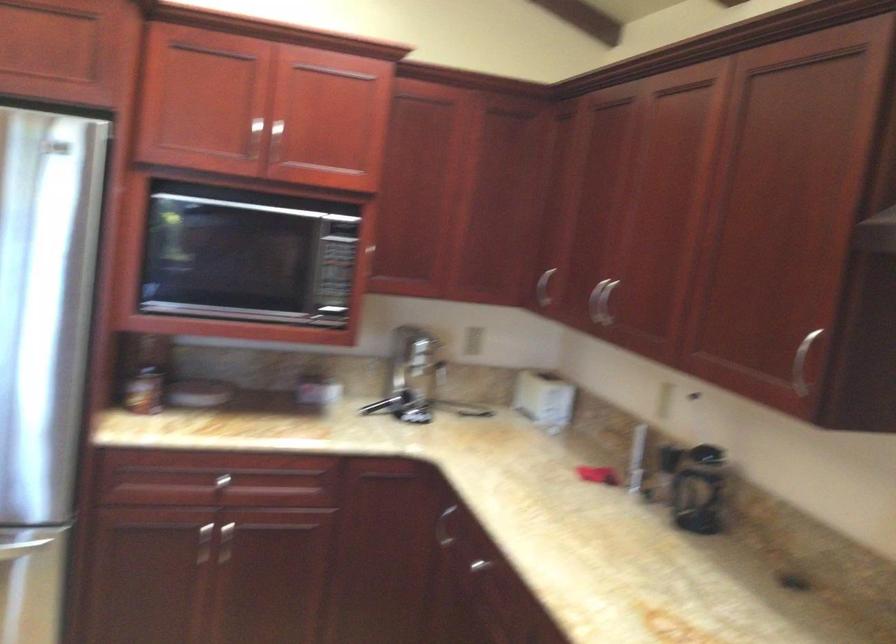
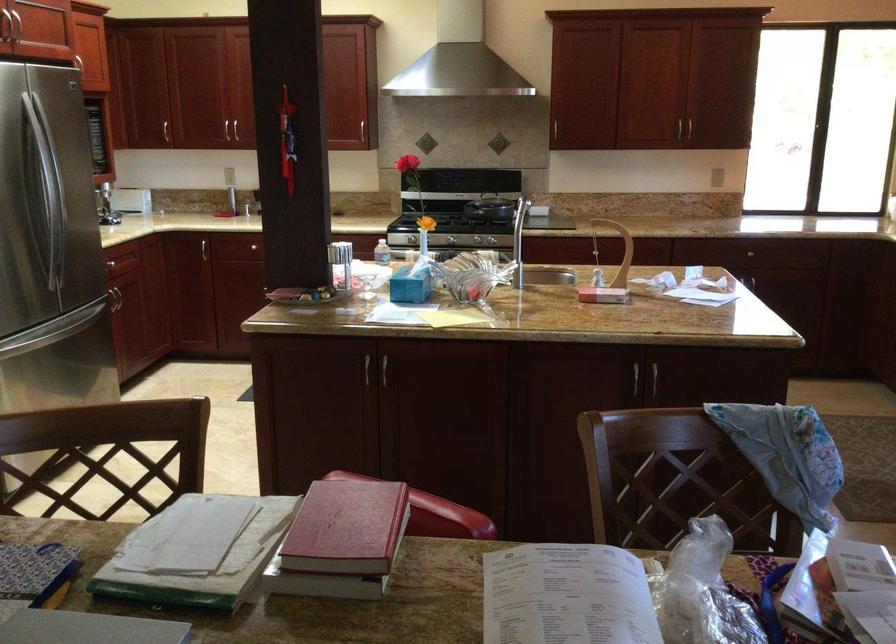
Find the pixel in the second image that matches the point at 690,351 in the first image.

(231, 131)